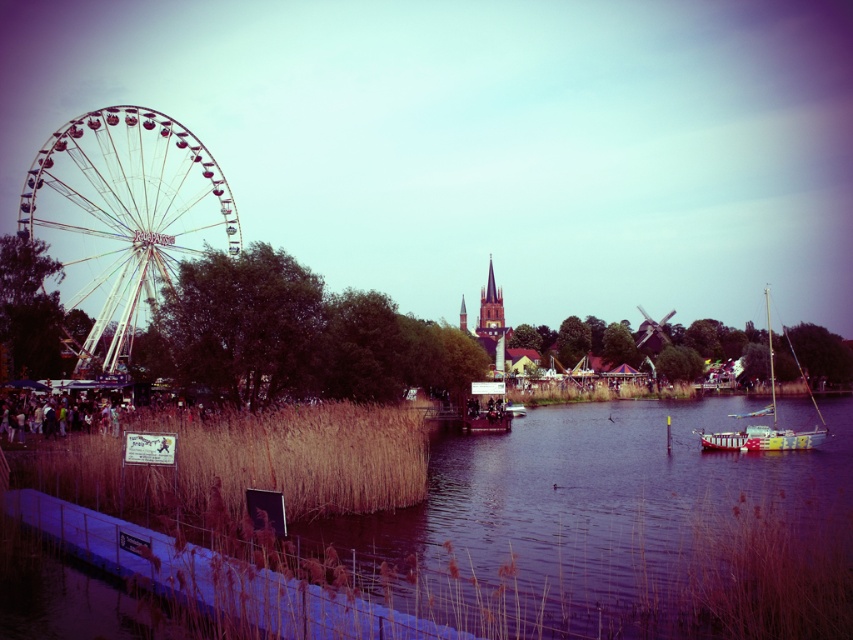
Between brown reeds at lower center and white metallic ferris wheel at left, which one is positioned lower?

Positioned lower is brown reeds at lower center.

Is brown reeds at lower center positioned before white metallic ferris wheel at left?

Yes, brown reeds at lower center is in front of white metallic ferris wheel at left.

Between point (749, 620) and point (152, 145), which one is positioned in front?

Positioned in front is point (749, 620).

At what (x,y) coordinates should I click in order to perform the action: click on brown reeds at lower center. Please return your answer as a coordinate pair (x, y). Image resolution: width=853 pixels, height=640 pixels. Looking at the image, I should click on (622, 528).

Does brown reeds at lower center come in front of painted wood sailboat at right?

Yes, brown reeds at lower center is in front of painted wood sailboat at right.

Can you confirm if brown reeds at lower center is thinner than painted wood sailboat at right?

Incorrect, brown reeds at lower center's width is not less than painted wood sailboat at right's.

Is point (546, 429) closer to viewer compared to point (769, 436)?

That is False.

I want to click on brown reeds at lower center, so click(622, 528).

Between white metallic ferris wheel at left and painted wood sailboat at right, which one appears on the left side from the viewer's perspective?

Positioned to the left is white metallic ferris wheel at left.

Between white metallic ferris wheel at left and painted wood sailboat at right, which one has more height?

Standing taller between the two is white metallic ferris wheel at left.

Image resolution: width=853 pixels, height=640 pixels. Find the location of `white metallic ferris wheel at left`. white metallic ferris wheel at left is located at coordinates (123, 218).

Where is `white metallic ferris wheel at left`? white metallic ferris wheel at left is located at coordinates (123, 218).